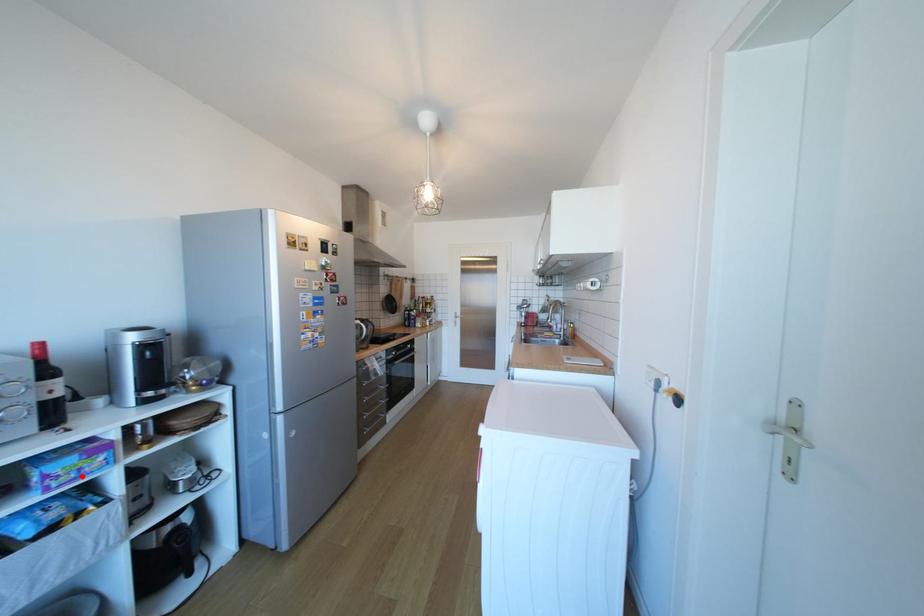
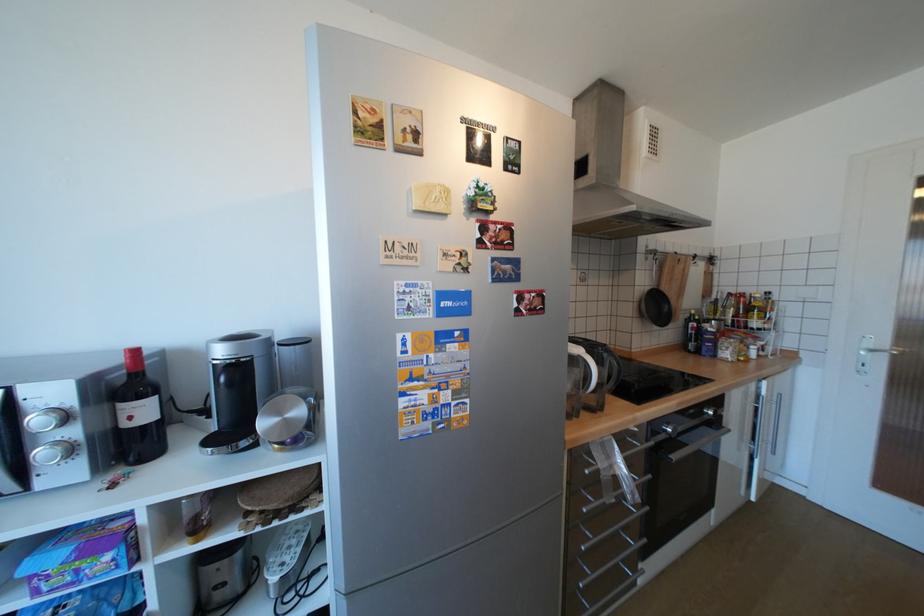
The point at the highlighted location is marked in the first image. Where is the corresponding point in the second image?

(79, 578)